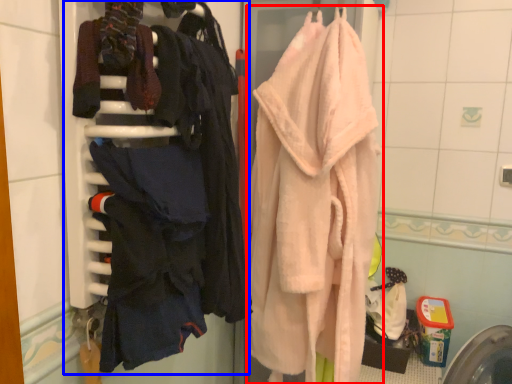
Question: Which object appears closest to the camera in this image, towel (highlighted by a red box) or closet (highlighted by a blue box)?

Choices:
 (A) towel
 (B) closet

Answer: (B)